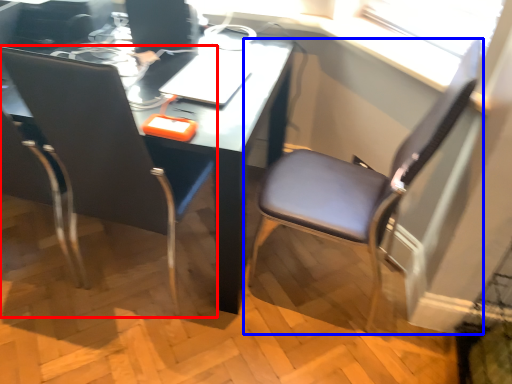
Question: Among these objects, which one is farthest to the camera, chair (highlighted by a red box) or chair (highlighted by a blue box)?

Choices:
 (A) chair
 (B) chair

Answer: (B)